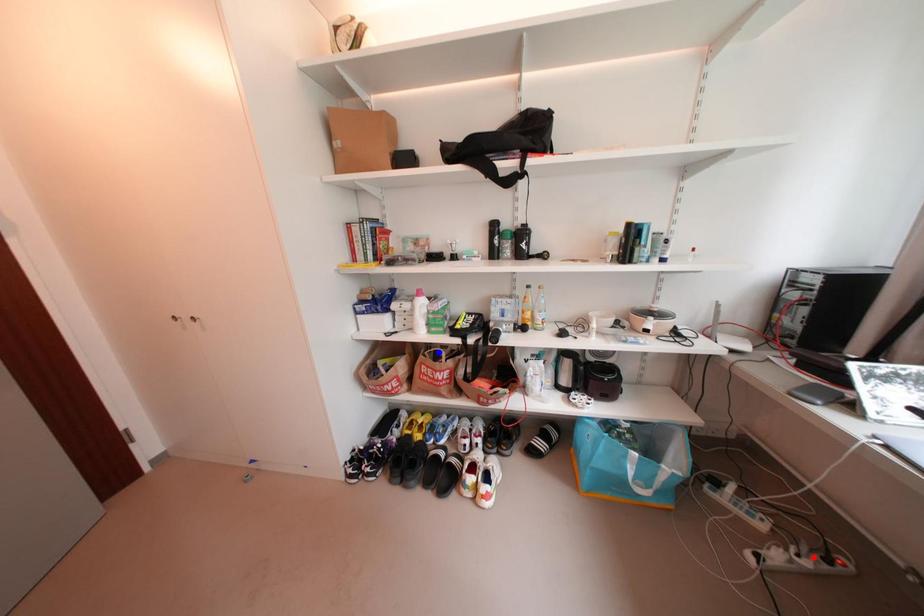
Question: In the image, two points are highlighted. Which point is nearer to the camera? Reply with the corresponding letter.

Choices:
 (A) blue point
 (B) red point

Answer: (B)